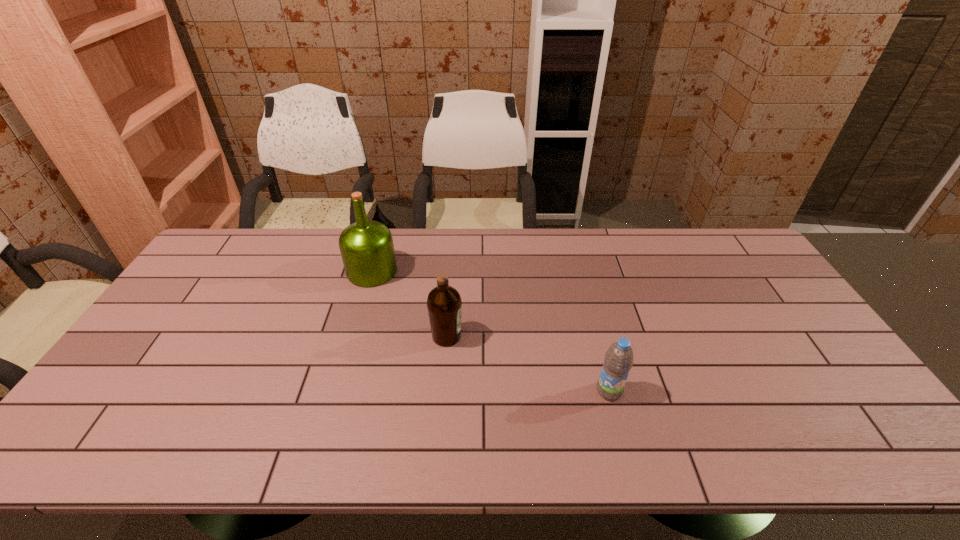
Where is `vacant area at the far edge of the desktop`? Image resolution: width=960 pixels, height=540 pixels. vacant area at the far edge of the desktop is located at coordinates (566, 245).

In the image, there is a desktop. Where is `vacant space at the near edge`? This screenshot has height=540, width=960. vacant space at the near edge is located at coordinates (476, 439).

The height and width of the screenshot is (540, 960). In order to click on vacant region at the left edge in this screenshot , I will do `click(159, 321)`.

The width and height of the screenshot is (960, 540). Find the location of `vacant space at the far left corner of the desktop`. vacant space at the far left corner of the desktop is located at coordinates (242, 232).

This screenshot has width=960, height=540. Identify the location of unoccupied position between the right olive oil and the tallest object. (409, 303).

Where is `free space between the farthest object and the shorter olive oil`? This screenshot has width=960, height=540. free space between the farthest object and the shorter olive oil is located at coordinates (409, 303).

You are a GUI agent. You are given a task and a screenshot of the screen. Output one action in this format:
    pyautogui.click(x=<x>, y=<y>)
    Task: Click on the free spot between the right olive oil and the farther olive oil
    
    Given the screenshot: What is the action you would take?
    pyautogui.click(x=409, y=303)

This screenshot has width=960, height=540. I want to click on free area in between the leftmost object and the second nearest object, so click(409, 303).

You are a GUI agent. You are given a task and a screenshot of the screen. Output one action in this format:
    pyautogui.click(x=<x>, y=<y>)
    Task: Click on the empty space that is in between the farther olive oil and the shortest object
    This screenshot has width=960, height=540.
    Given the screenshot: What is the action you would take?
    pyautogui.click(x=491, y=331)

In order to click on empty space that is in between the left olive oil and the nearer olive oil in this screenshot , I will do `click(409, 303)`.